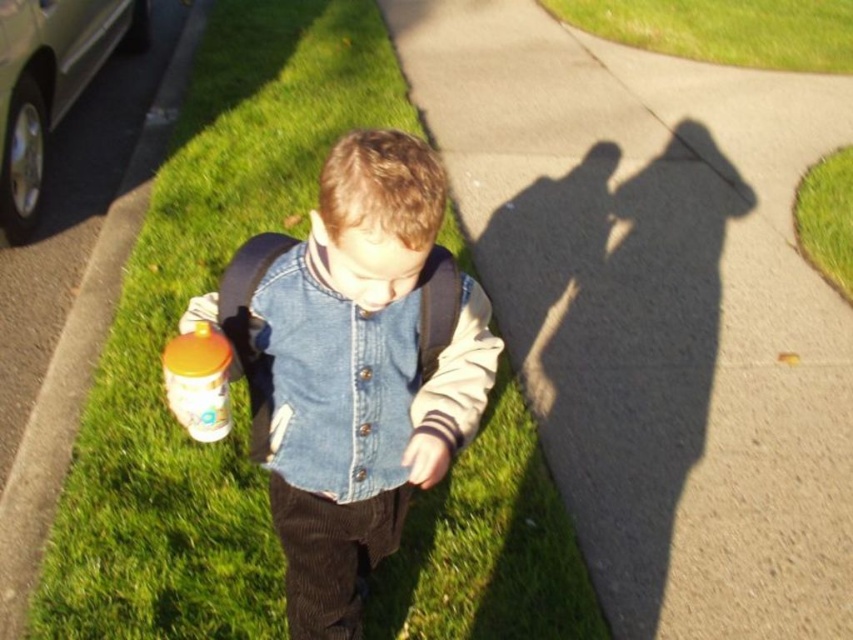
Question: Which of these objects is positioned farthest from the denim vest at center?

Choices:
 (A) smooth concrete sidewalk at center
 (B) green grass at lower right
 (C) denim jacket at center
 (D) yellow matte cup at lower left

Answer: (B)

Question: Can you confirm if denim jacket at center is bigger than yellow matte cup at lower left?

Choices:
 (A) no
 (B) yes

Answer: (B)

Question: Can you confirm if green grass at lower right is positioned above yellow matte cup at lower left?

Choices:
 (A) no
 (B) yes

Answer: (B)

Question: Which object is positioned farthest from the denim vest at center?

Choices:
 (A) smooth concrete sidewalk at center
 (B) denim jacket at center
 (C) green grass at lower right

Answer: (C)

Question: Is the position of green grass at lower left more distant than that of green grass at upper right?

Choices:
 (A) yes
 (B) no

Answer: (B)

Question: Which object appears closest to the camera in this image?

Choices:
 (A) green grass at upper right
 (B) denim vest at center

Answer: (B)